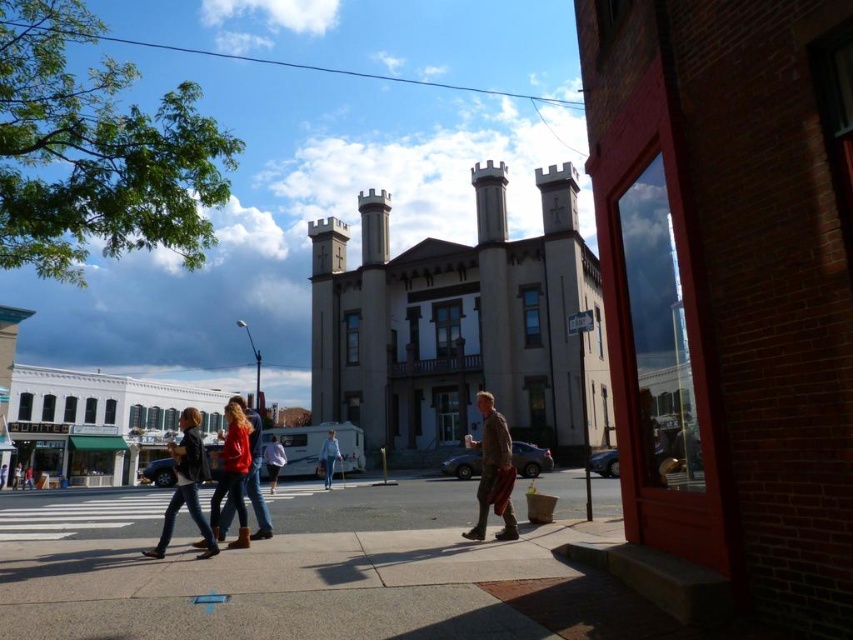
Question: Does red matte jacket at center appear under denim jacket at center?

Choices:
 (A) no
 (B) yes

Answer: (A)

Question: Which point is closer to the camera?

Choices:
 (A) (183, 458)
 (B) (28, 468)

Answer: (A)

Question: Is gray concrete sidewalk at lower center bigger than denim pants at center?

Choices:
 (A) yes
 (B) no

Answer: (A)

Question: Does brown textured pants at center have a lesser width compared to denim jacket at center?

Choices:
 (A) no
 (B) yes

Answer: (A)

Question: Which of the following is the farthest from the observer?

Choices:
 (A) denim jacket at lower left
 (B) denim jacket at center
 (C) denim pants at center
 (D) leather jacket at center

Answer: (A)

Question: Considering the real-world distances, which object is farthest from the denim pants at center?

Choices:
 (A) denim jacket at center
 (B) light blue fabric jacket at center
 (C) red cotton jacket at center
 (D) red matte jacket at center

Answer: (D)